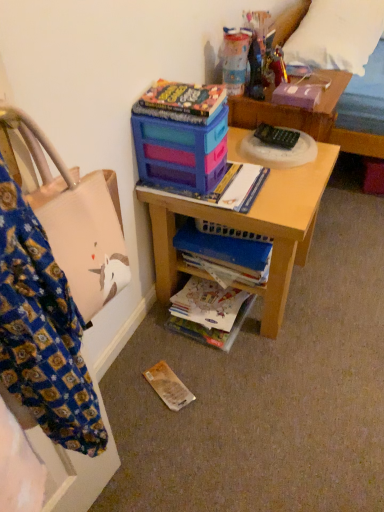
Find the location of a particular element. vacant space situated above blue matte book at center, the 2th book positioned from the bottom (from a real-world perspective) is located at coordinates (216, 232).